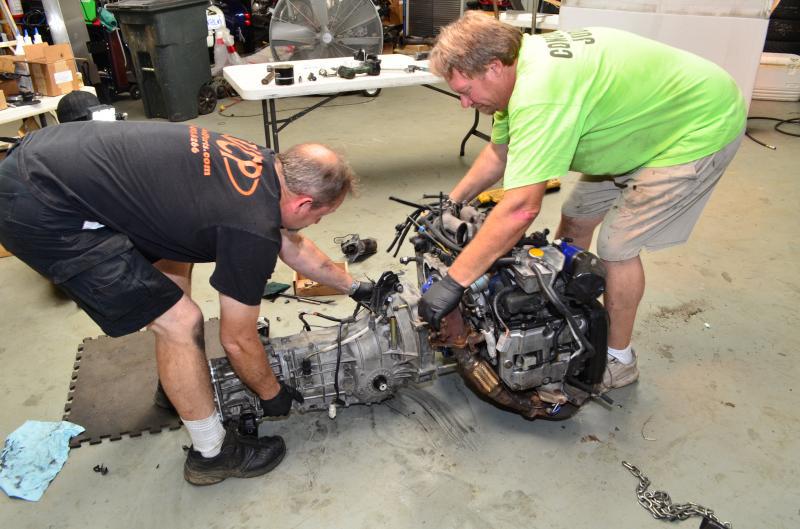
Locate an element on the screen. white table is located at coordinates (250, 76).